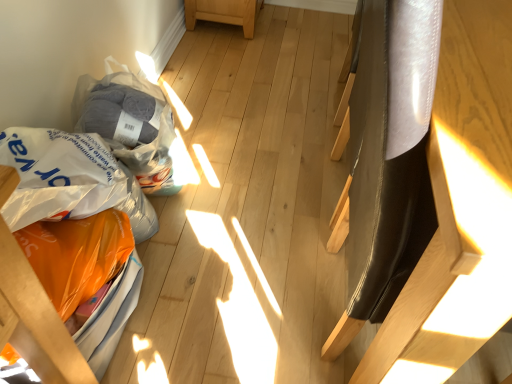
Question: From a real-world perspective, is orange plastic bag at lower left, marked as the 1th furniture in a left-to-right arrangement, positioned over orange plastic grocery bag at lower left, the second grocery bag when ordered from top to bottom, based on gravity?

Choices:
 (A) yes
 (B) no

Answer: (A)

Question: Is orange plastic bag at lower left, which ranks as the second furniture in right-to-left order, looking in the opposite direction of orange plastic grocery bag at lower left, which ranks as the 1th grocery bag in bottom-to-top order?

Choices:
 (A) no
 (B) yes

Answer: (A)

Question: Can you confirm if orange plastic bag at lower left, marked as the 1th furniture in a left-to-right arrangement, is bigger than orange plastic grocery bag at lower left, which ranks as the 1th grocery bag in bottom-to-top order?

Choices:
 (A) yes
 (B) no

Answer: (A)

Question: Considering the relative positions of orange plastic bag at lower left, which ranks as the second furniture in right-to-left order, and orange plastic grocery bag at lower left, which ranks as the 1th grocery bag in bottom-to-top order, in the image provided, is orange plastic bag at lower left, which ranks as the second furniture in right-to-left order, in front of orange plastic grocery bag at lower left, which ranks as the 1th grocery bag in bottom-to-top order,?

Choices:
 (A) no
 (B) yes

Answer: (B)

Question: Is orange plastic bag at lower left, marked as the 1th furniture in a left-to-right arrangement, far from orange plastic grocery bag at lower left, which ranks as the 1th grocery bag in bottom-to-top order?

Choices:
 (A) no
 (B) yes

Answer: (A)

Question: Is orange plastic bag at lower left, marked as the 1th furniture in a left-to-right arrangement, touching orange plastic grocery bag at lower left, which ranks as the 1th grocery bag in bottom-to-top order?

Choices:
 (A) no
 (B) yes

Answer: (A)

Question: Is orange plastic bag at lower left, marked as the 1th furniture in a left-to-right arrangement, far from translucent plastic grocery bag at lower left, which ranks as the 2th grocery bag in bottom-to-top order?

Choices:
 (A) no
 (B) yes

Answer: (A)

Question: From a real-world perspective, is orange plastic bag at lower left, marked as the 1th furniture in a left-to-right arrangement, positioned over translucent plastic grocery bag at lower left, the first grocery bag viewed from the top, based on gravity?

Choices:
 (A) no
 (B) yes

Answer: (B)

Question: From the image's perspective, does orange plastic bag at lower left, which ranks as the second furniture in right-to-left order, appear lower than translucent plastic grocery bag at lower left, the first grocery bag viewed from the top?

Choices:
 (A) no
 (B) yes

Answer: (B)

Question: Is orange plastic bag at lower left, which ranks as the second furniture in right-to-left order, turned away from translucent plastic grocery bag at lower left, which ranks as the 2th grocery bag in bottom-to-top order?

Choices:
 (A) yes
 (B) no

Answer: (B)

Question: Is orange plastic bag at lower left, marked as the 1th furniture in a left-to-right arrangement, thinner than translucent plastic grocery bag at lower left, which ranks as the 2th grocery bag in bottom-to-top order?

Choices:
 (A) yes
 (B) no

Answer: (B)

Question: Would you say orange plastic bag at lower left, which ranks as the second furniture in right-to-left order, is outside translucent plastic grocery bag at lower left, which ranks as the 2th grocery bag in bottom-to-top order?

Choices:
 (A) yes
 (B) no

Answer: (A)

Question: Is orange plastic grocery bag at lower left, the second grocery bag when ordered from top to bottom, bigger than shiny black chair at right, which appears as the first furniture when viewed from the right?

Choices:
 (A) no
 (B) yes

Answer: (A)